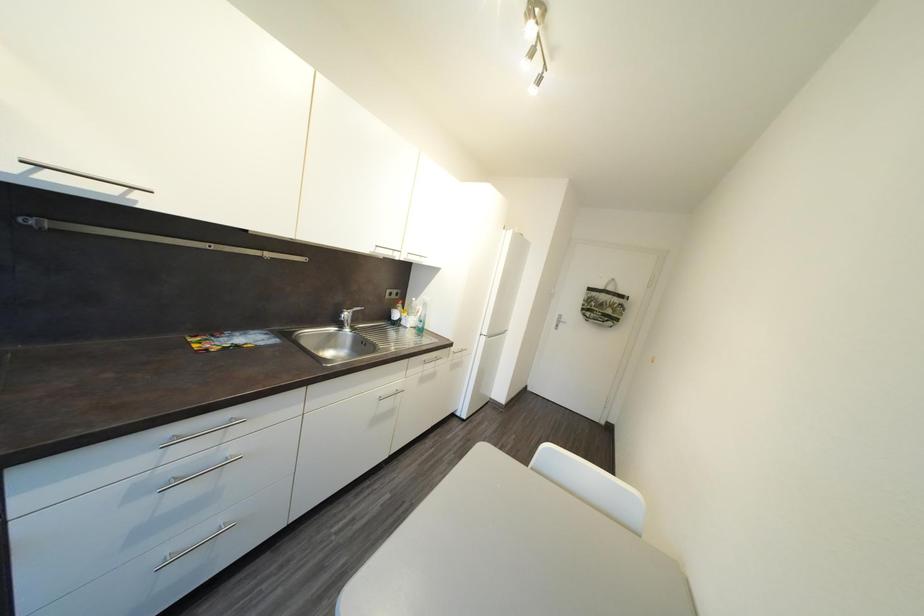
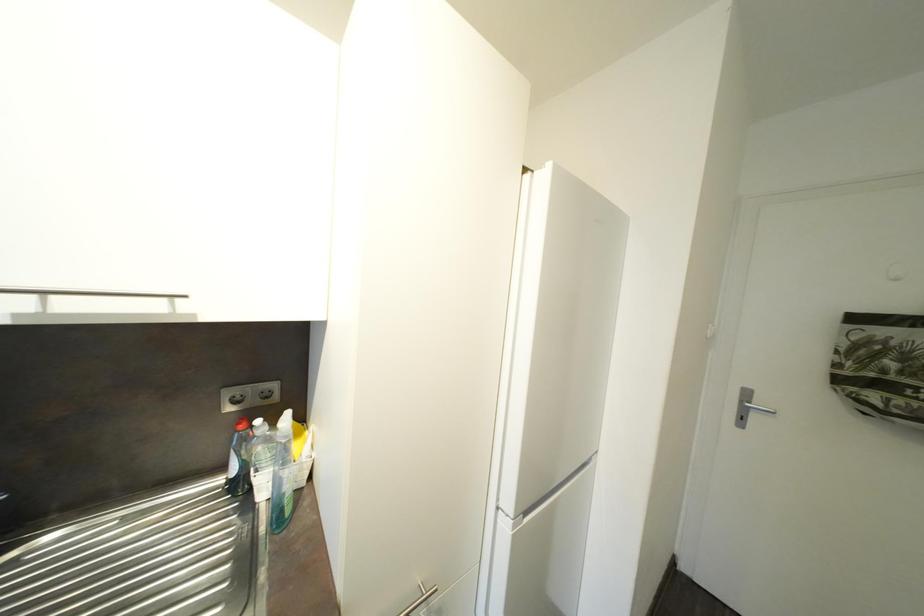
Question: The images are taken continuously from a first-person perspective. In which direction are you moving?

Choices:
 (A) Left
 (B) Right
 (C) Forward
 (D) Backward

Answer: (C)